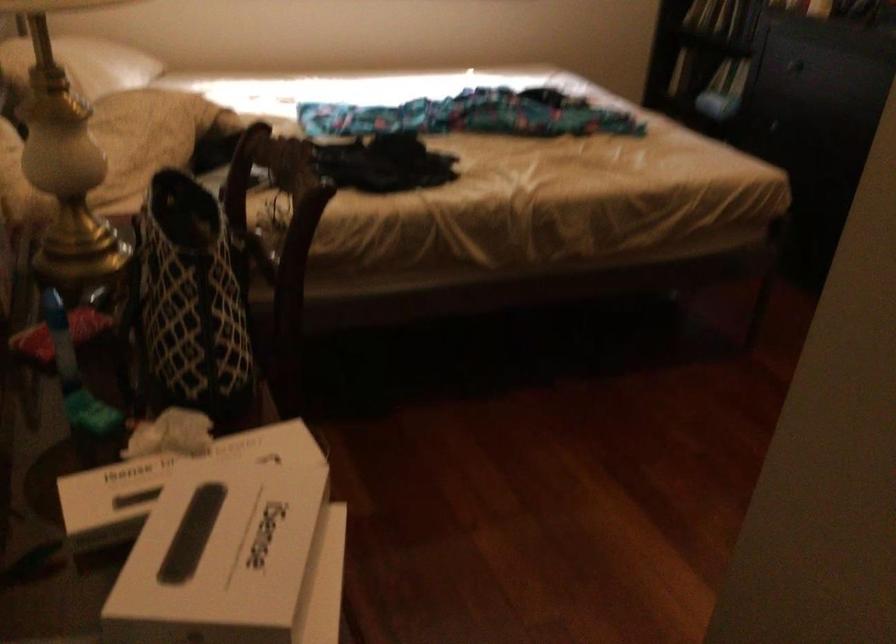
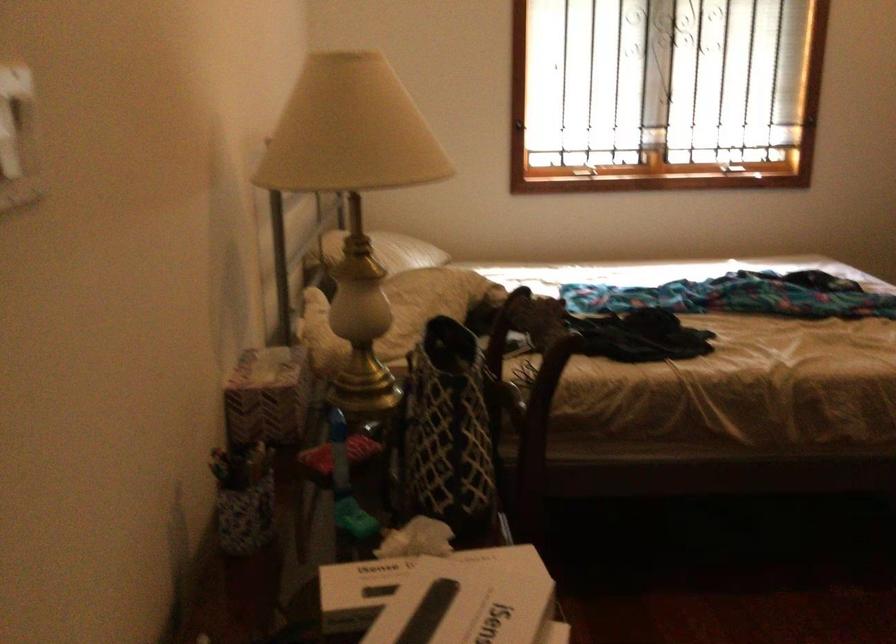
Find the pixel in the second image that matches (170,489) in the first image.

(407, 583)